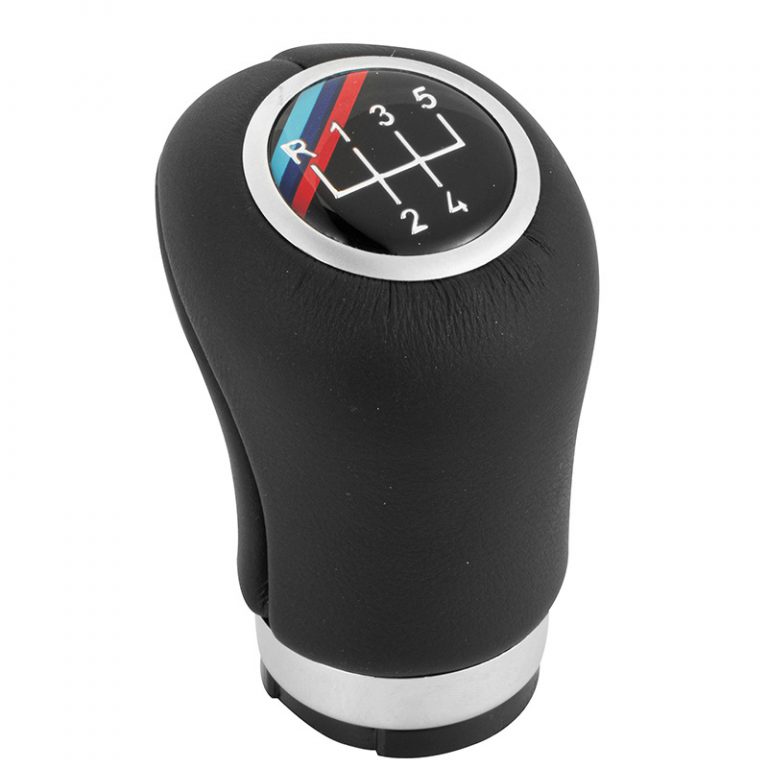
The image size is (768, 768). Find the location of `silver band around the bottom of the knob`. silver band around the bottom of the knob is located at coordinates (372, 694).